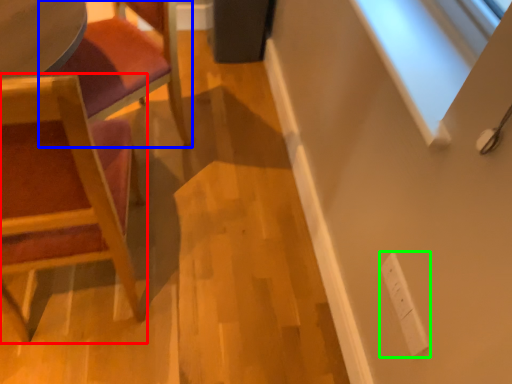
Question: Which object is positioned farthest from chair (highlighted by a red box)? Select from chair (highlighted by a blue box) and electric outlet (highlighted by a green box).

Choices:
 (A) chair
 (B) electric outlet

Answer: (B)